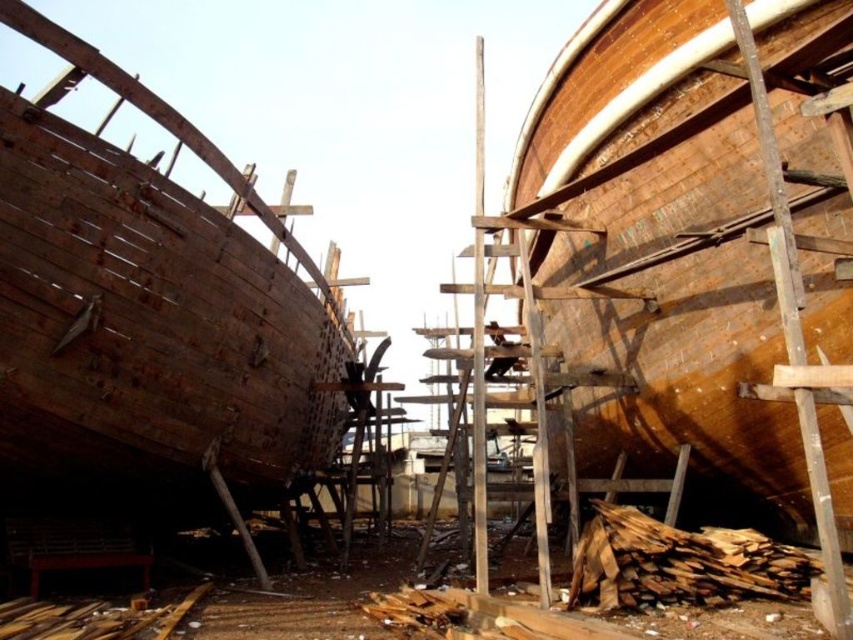
Question: Does rusty wood boat at left appear on the right side of wooden planks at lower right?

Choices:
 (A) no
 (B) yes

Answer: (A)

Question: Which of the following is the closest to the observer?

Choices:
 (A) (36, 243)
 (B) (685, 602)

Answer: (A)

Question: Which point is farther from the camera taking this photo?

Choices:
 (A) (697, 554)
 (B) (54, 404)

Answer: (A)

Question: Can you confirm if rusty wood boat at left is thinner than wooden planks at lower right?

Choices:
 (A) yes
 (B) no

Answer: (A)

Question: In this image, where is rusty wood boat at left located relative to wooden planks at lower right?

Choices:
 (A) right
 (B) left

Answer: (B)